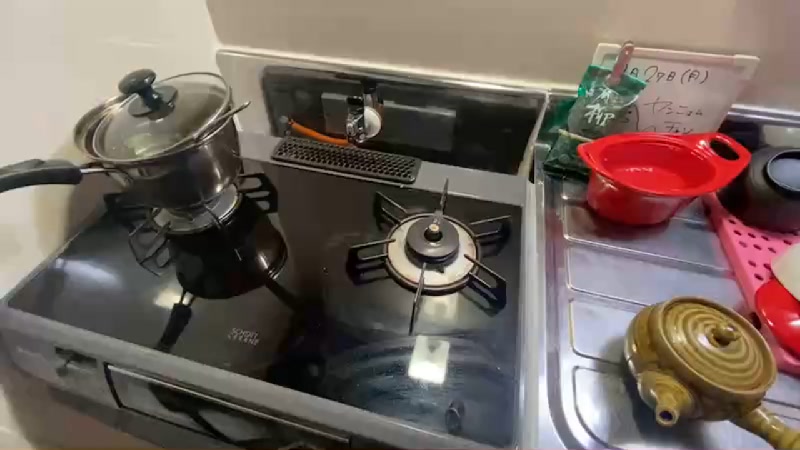
Find the location of a particular element. Image resolution: width=800 pixels, height=450 pixels. pink disk drying mat is located at coordinates (764, 251).